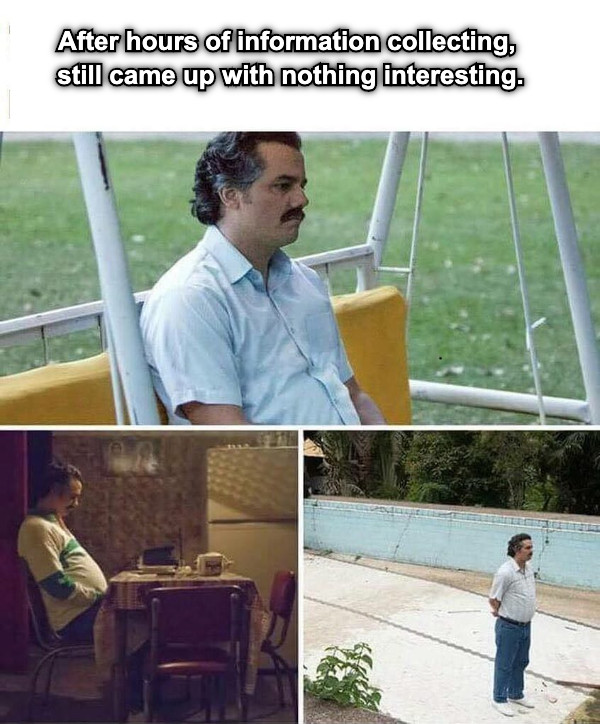
Where is `kitchen chairs`? kitchen chairs is located at coordinates (281, 591), (191, 620), (33, 597).